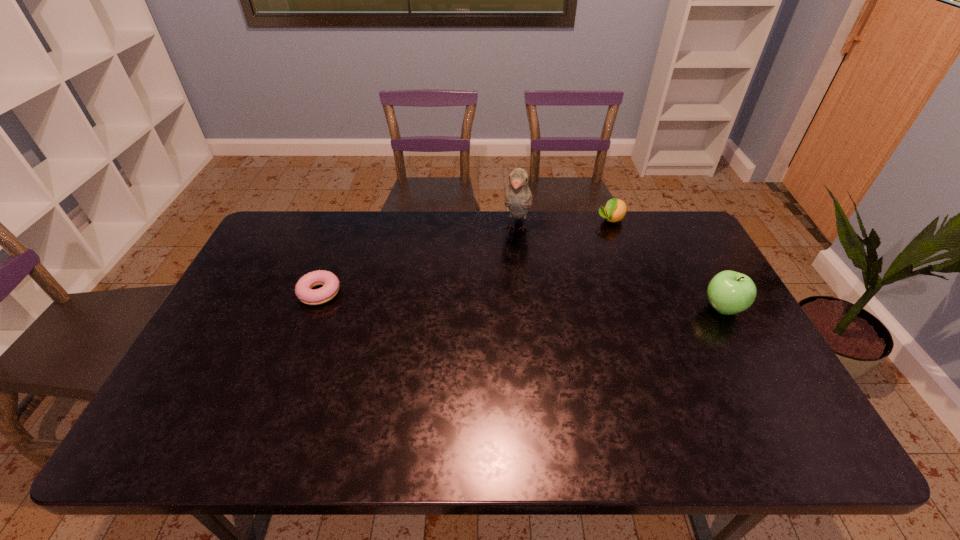
I want to click on vacant space positioned 0.310m at the face of the tallest object, so click(499, 316).

This screenshot has width=960, height=540. In order to click on vacant space positioned at the face of the tallest object in this screenshot , I will do `click(497, 327)`.

The height and width of the screenshot is (540, 960). Identify the location of free region located at the face of the tallest object. (509, 278).

Find the location of a particular element. The image size is (960, 540). free space located with leaves positioned above the third tallest object is located at coordinates (579, 265).

At what (x,y) coordinates should I click in order to perform the action: click on vacant space located 0.180m with leaves positioned above the third tallest object. Please return your answer as a coordinate pair (x, y). The image size is (960, 540). Looking at the image, I should click on (586, 256).

The height and width of the screenshot is (540, 960). I want to click on vacant space located 0.310m with leaves positioned above the third tallest object, so click(568, 279).

You are a GUI agent. You are given a task and a screenshot of the screen. Output one action in this format:
    pyautogui.click(x=<x>, y=<y>)
    Task: Click on the bird situated at the far edge
    
    Given the screenshot: What is the action you would take?
    pyautogui.click(x=518, y=198)

Identify the location of lemon that is at the far edge. The height and width of the screenshot is (540, 960). (614, 211).

I want to click on object situated at the right edge, so click(729, 292).

In the image, there is a desktop. Where is `free space at the far edge`? free space at the far edge is located at coordinates (635, 224).